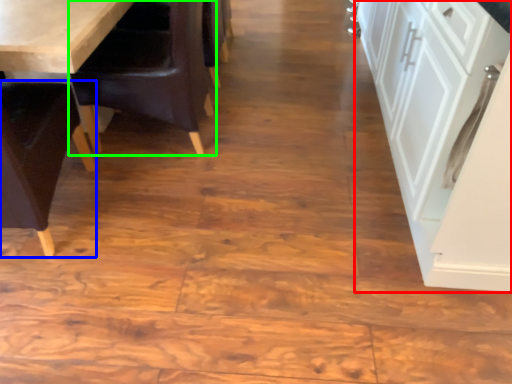
Question: Estimate the real-world distances between objects in this image. Which object is closer to cabinetry (highlighted by a red box), chair (highlighted by a blue box) or chair (highlighted by a green box)?

Choices:
 (A) chair
 (B) chair

Answer: (B)